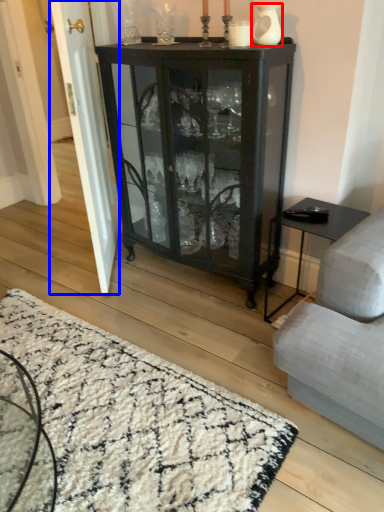
Question: Which point is further to the camera, glass vase (highlighted by a red box) or screen door (highlighted by a blue box)?

Choices:
 (A) glass vase
 (B) screen door

Answer: (B)